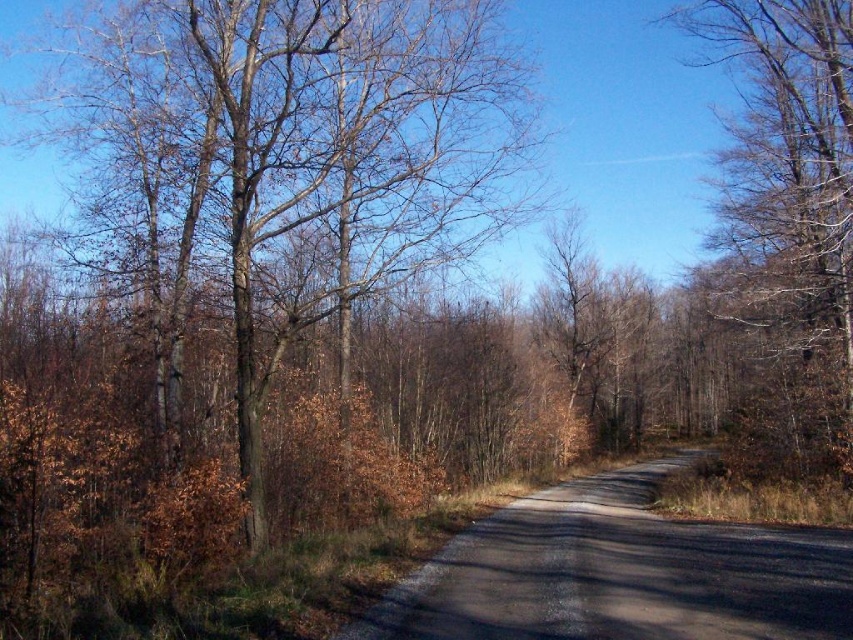
From the picture: You are standing at the point labeled point at (334,218). You want to walk to the other side of the road, which is 25.55 meters away. If your walking speed is 1.5 meters per second, how many seconds will it take you to reach the other side?

It will take approximately 17 seconds to reach the other side because 25.55 meters divided by 1.5 meters per second equals approximately 17 seconds.

You are standing on the road and see the brown bark tree at left and the brown bark tree at right. Which tree is closer to your left side?

The brown bark tree at left is closer to your left side because it is positioned on the left side of the brown bark tree at right.